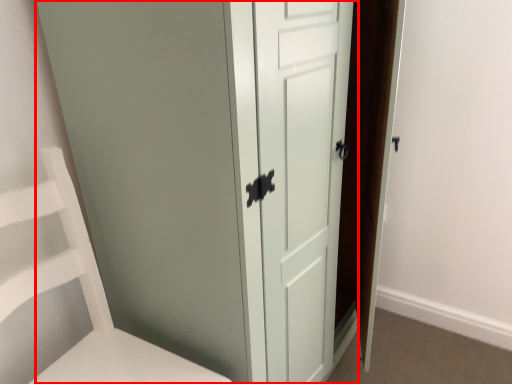
Question: From the image's perspective, what is the correct spatial positioning of door (annotated by the red box) in reference to furniture?

Choices:
 (A) below
 (B) above

Answer: (B)